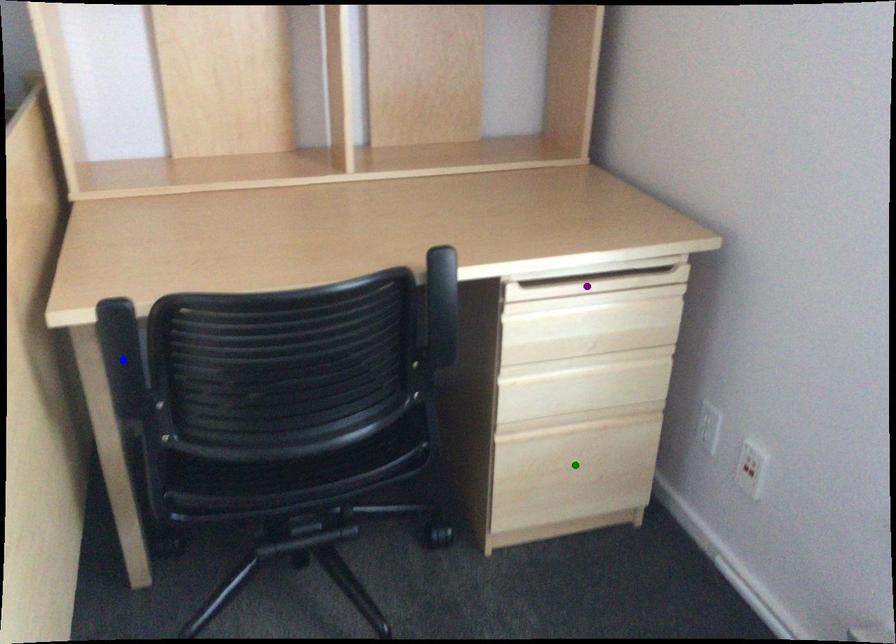
Order these from nearest to farthest:
purple point, green point, blue point

1. blue point
2. purple point
3. green point